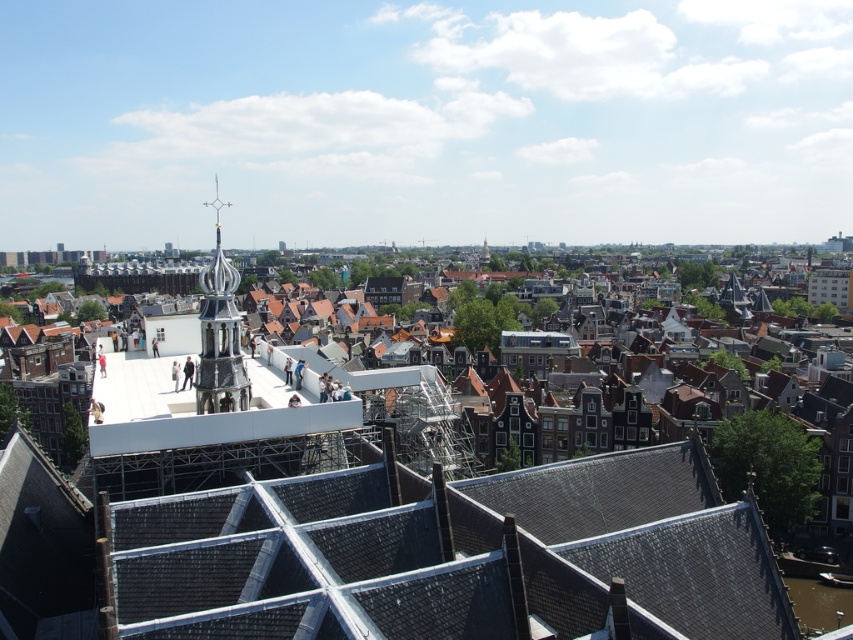
You are a city planner analyzing this cityscape image. You notice a point labeled at coordinates (219, 333). What architectural feature does this point correspond to?

The point at coordinates (219, 333) corresponds to the polished silver spire at center left.